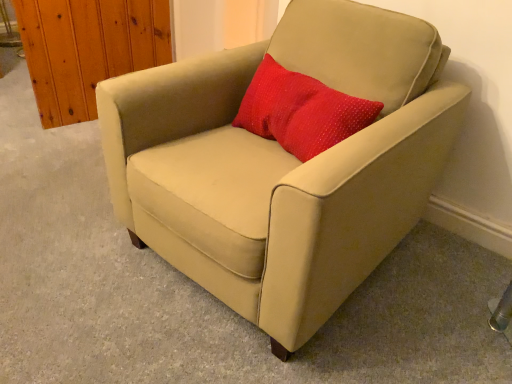
Question: Considering the relative sizes of red dotted fabric pillow at center and beige fabric armchair at center in the image provided, is red dotted fabric pillow at center wider than beige fabric armchair at center?

Choices:
 (A) yes
 (B) no

Answer: (B)

Question: Is red dotted fabric pillow at center beside beige fabric armchair at center?

Choices:
 (A) no
 (B) yes

Answer: (A)

Question: From a real-world perspective, is red dotted fabric pillow at center beneath beige fabric armchair at center?

Choices:
 (A) no
 (B) yes

Answer: (A)

Question: Is red dotted fabric pillow at center bigger than beige fabric armchair at center?

Choices:
 (A) no
 (B) yes

Answer: (A)

Question: Is red dotted fabric pillow at center surrounding beige fabric armchair at center?

Choices:
 (A) yes
 (B) no

Answer: (B)

Question: Does red dotted fabric pillow at center appear on the left side of beige fabric armchair at center?

Choices:
 (A) no
 (B) yes

Answer: (A)

Question: Does beige fabric armchair at center have a smaller size compared to red dotted fabric pillow at center?

Choices:
 (A) yes
 (B) no

Answer: (B)

Question: Are beige fabric armchair at center and red dotted fabric pillow at center far apart?

Choices:
 (A) no
 (B) yes

Answer: (A)

Question: Does beige fabric armchair at center have a lesser height compared to red dotted fabric pillow at center?

Choices:
 (A) no
 (B) yes

Answer: (A)

Question: From the image's perspective, is beige fabric armchair at center on red dotted fabric pillow at center?

Choices:
 (A) yes
 (B) no

Answer: (B)

Question: Can you confirm if beige fabric armchair at center is thinner than red dotted fabric pillow at center?

Choices:
 (A) no
 (B) yes

Answer: (A)

Question: Is beige fabric armchair at center at the left side of red dotted fabric pillow at center?

Choices:
 (A) no
 (B) yes

Answer: (B)

Question: Considering the positions of point (395, 208) and point (334, 114), is point (395, 208) closer or farther from the camera than point (334, 114)?

Choices:
 (A) closer
 (B) farther

Answer: (A)